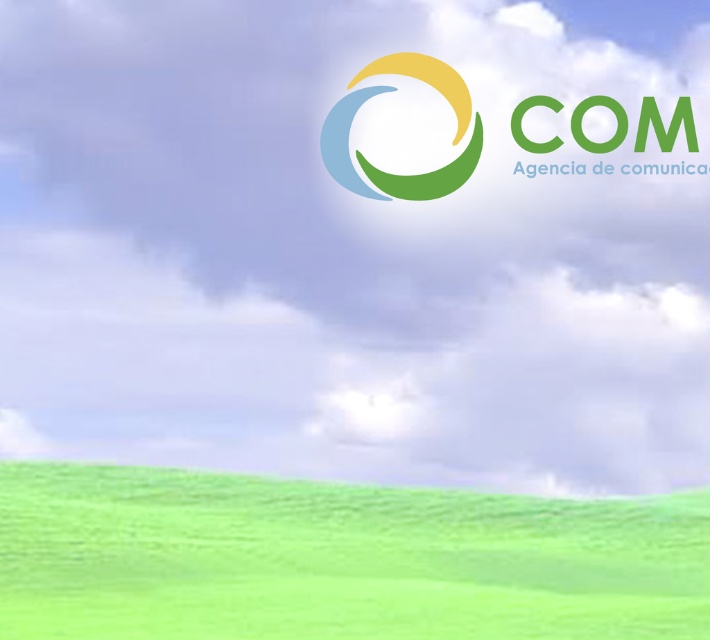
You are standing at the edge of the green grassy field at lower center and want to reach a tree located 5.42 meters away. Can you walk straight ahead to reach it without deviating from your path?

Yes, since the green grassy field at lower center is flat and unobstructed, you can walk straight ahead for 5.42 meters to reach the tree without needing to change direction.

You are standing in the middle of the green grassy field at lower center and looking towards the matte plastic logo at center. Which object appears taller from your perspective?

The matte plastic logo at center appears taller than the green grassy field at lower center because the description states that the green grassy field at lower center has a lesser height compared to the matte plastic logo at center.

You are standing at the center of the image and want to walk to the green grassy field at lower center. In which direction should you head?

The green grassy field at lower center is located at point [337,560], which is to the lower right of the center. Therefore, you should head towards the lower right direction to reach it.